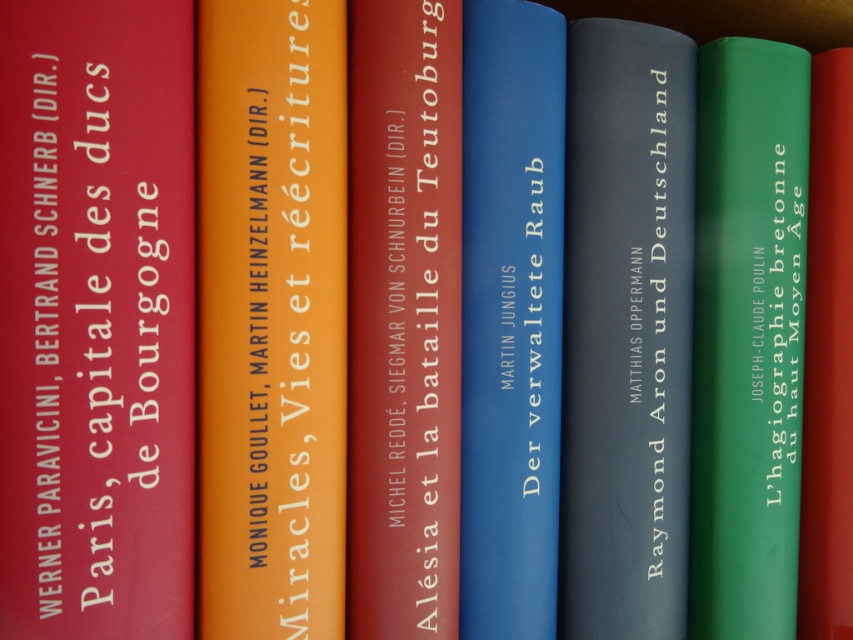
You are standing in front of the bookshelf with the six books. You want to reach the point labeled as point (834, 145) first and then the point labeled as point (770, 600). Which path would require you to move forward first before turning around?

To reach point (834, 145) first and then point (770, 600), you need to move forward first because point (834, 145) is behind point (770, 600). After reaching the first point, you can turn around to access the second point.

You are organizing a bookshelf and need to place the green matte book at right and the green matte book at center. What is the minimum distance you should leave between them to ensure they don not touch?

The green matte book at right and the green matte book at center are 3.06 inches apart from each other, so you should leave at least 3.06 inches between them to prevent touching.

You are organizing a library shelf and notice two green matte books in the collection of six hardcover books. The green matte book at right and the green matte book at center are both present. Based on their positions, which one is placed higher on the shelf?

The green matte book at right is located above the green matte book at center, so it is placed higher on the shelf.